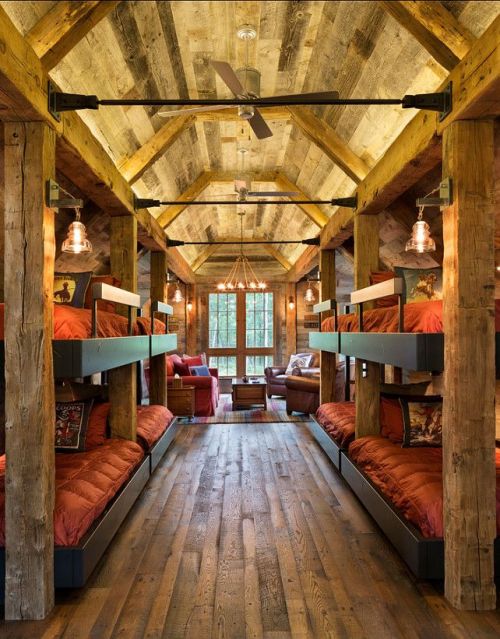
Locate an element on the screen. This screenshot has width=500, height=639. pillo is located at coordinates [x=75, y=431], [x=69, y=289], [x=208, y=371], [x=194, y=362], [x=294, y=362], [x=428, y=422], [x=422, y=278].